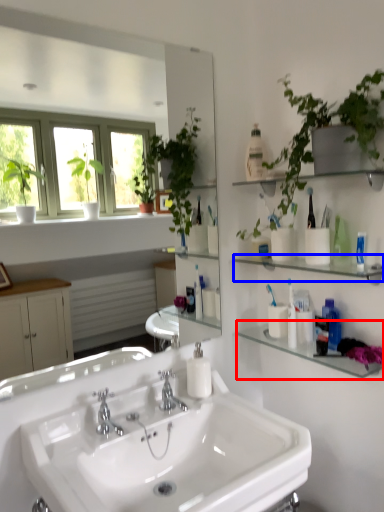
Question: Which of the following is the farthest to the observer, shelf (highlighted by a red box) or shelf (highlighted by a blue box)?

Choices:
 (A) shelf
 (B) shelf

Answer: (A)